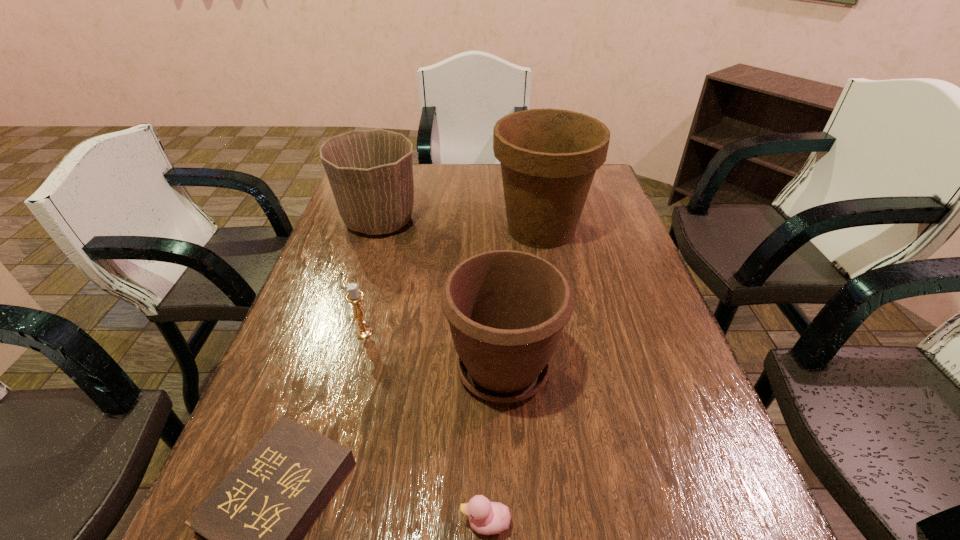
Identify the location of object that is at the right edge. (549, 157).

You are a GUI agent. You are given a task and a screenshot of the screen. Output one action in this format:
    pyautogui.click(x=<x>, y=<y>)
    Task: Click on the vacant space at the far edge of the desktop
    Image resolution: width=960 pixels, height=540 pixels.
    Given the screenshot: What is the action you would take?
    pyautogui.click(x=457, y=194)

Locate an element on the screen. free location at the left edge of the desktop is located at coordinates (331, 363).

Where is `free region at the right edge`? The height and width of the screenshot is (540, 960). free region at the right edge is located at coordinates tap(615, 204).

At what (x,y) coordinates should I click in order to perform the action: click on free space between the leftmost flowerpot and the tallest object. Please return your answer as a coordinate pair (x, y). Image resolution: width=960 pixels, height=540 pixels. Looking at the image, I should click on (460, 225).

Locate which object is the fourth closest to the leftmost flowerpot. Please provide its 2D coordinates. Your answer should be formatted as a tuple, i.e. [(x, y)], where the tuple contains the x and y coordinates of a point satisfying the conditions above.

[(252, 524)]

You are a GUI agent. You are given a task and a screenshot of the screen. Output one action in this format:
    pyautogui.click(x=<x>, y=<y>)
    Task: Click on the fifth closest object relative to the nearest flowerpot
    This screenshot has width=960, height=540.
    Given the screenshot: What is the action you would take?
    pyautogui.click(x=370, y=172)

At what (x,y) coordinates should I click in order to perform the action: click on flowerpot that is the closest one to the leftmost flowerpot. Please return your answer as a coordinate pair (x, y). This screenshot has height=540, width=960. Looking at the image, I should click on [x=549, y=157].

You are a GUI agent. You are given a task and a screenshot of the screen. Output one action in this format:
    pyautogui.click(x=<x>, y=<y>)
    Task: Click on the flowerpot that is the closest to the nearest flowerpot
    
    Given the screenshot: What is the action you would take?
    pyautogui.click(x=549, y=157)

The image size is (960, 540). Identify the location of free space that satisfies the following two spatial constraints: 1. on the front side of the leftmost flowerpot; 2. on the right side of the nearest flowerpot. (334, 368).